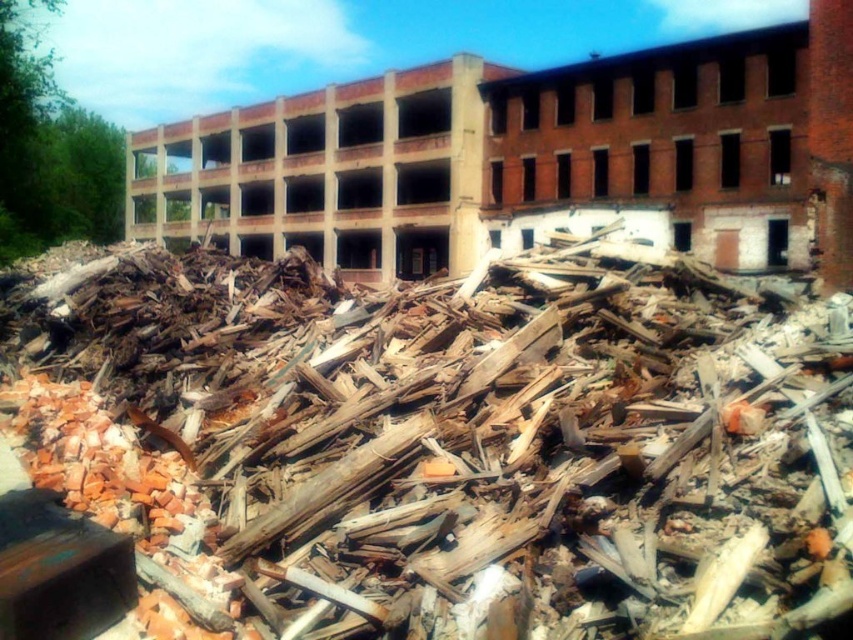
Question: Which of the following is the closest to the observer?

Choices:
 (A) (705, 179)
 (B) (392, 636)

Answer: (B)

Question: Which object appears farthest from the camera in this image?

Choices:
 (A) brick rubble at center
 (B) brown wood debris at center

Answer: (A)

Question: Which of the following is the farthest from the observer?

Choices:
 (A) (685, 168)
 (B) (619, 621)

Answer: (A)

Question: Does brown wood debris at center appear under brick rubble at center?

Choices:
 (A) no
 (B) yes

Answer: (B)

Question: Can you confirm if brown wood debris at center is wider than brick rubble at center?

Choices:
 (A) yes
 (B) no

Answer: (B)

Question: Where is brown wood debris at center located in relation to brick rubble at center in the image?

Choices:
 (A) above
 (B) below

Answer: (B)